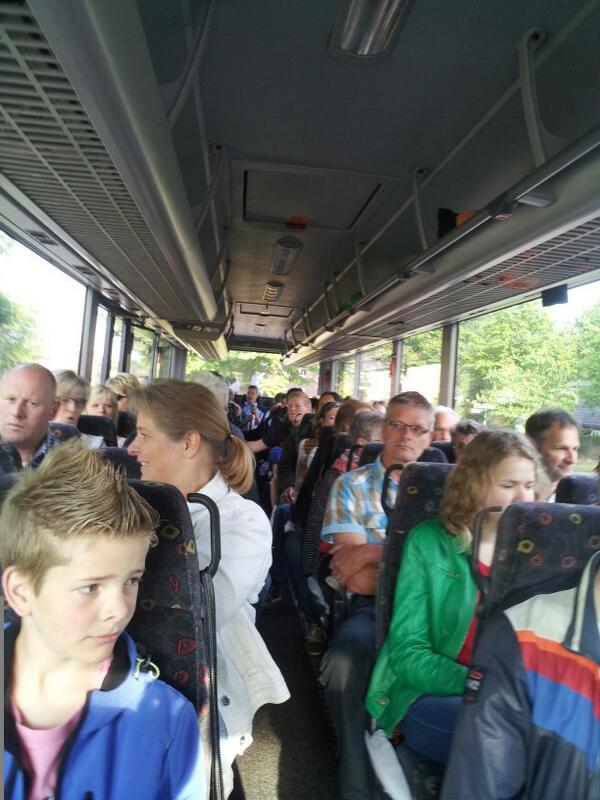
The height and width of the screenshot is (800, 600). Find the location of `vent`. vent is located at coordinates (26, 74), (59, 178), (109, 258), (152, 272), (554, 266), (452, 317).